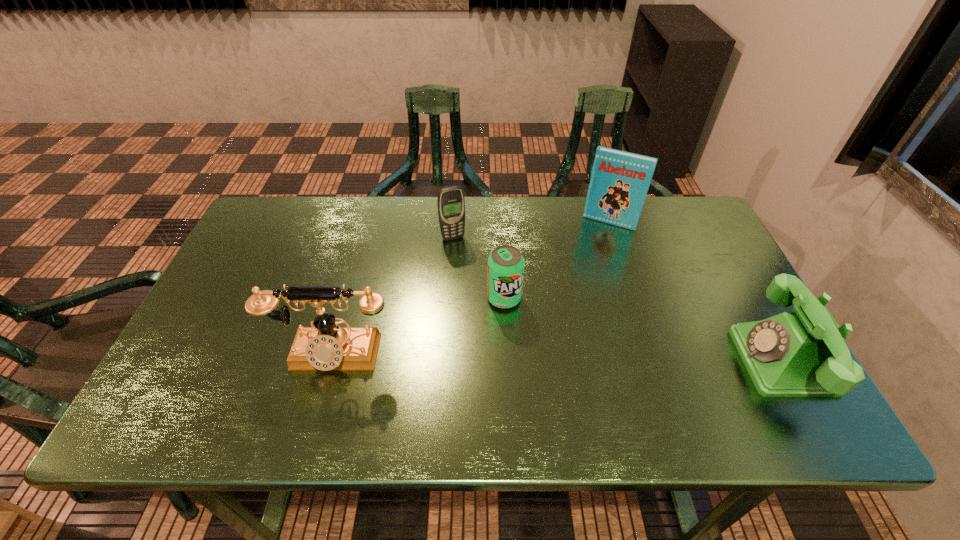
Where is `empty space between the shorter telephone and the cellular telephone`? empty space between the shorter telephone and the cellular telephone is located at coordinates (617, 299).

The height and width of the screenshot is (540, 960). Identify the location of object that is the third closest one to the fourth nearest object. point(620,180).

Locate an element on the screen. object identified as the second closest to the right telephone is located at coordinates (505, 270).

The width and height of the screenshot is (960, 540). I want to click on free location that satisfies the following two spatial constraints: 1. on the front side of the cellular telephone; 2. on the dial of the right telephone, so click(445, 361).

You are a GUI agent. You are given a task and a screenshot of the screen. Output one action in this format:
    pyautogui.click(x=<x>, y=<y>)
    Task: Click on the vacant area that satisfies the following two spatial constraints: 1. on the dial of the shorter telephone; 2. on the dial of the leftmost object
    
    Given the screenshot: What is the action you would take?
    pyautogui.click(x=331, y=361)

Identify the location of vacant position in the image that satisfies the following two spatial constraints: 1. on the dial of the taller telephone; 2. on the dial of the shorter telephone. (331, 361).

This screenshot has width=960, height=540. I want to click on free space that satisfies the following two spatial constraints: 1. on the front side of the third object from left to right; 2. on the dial of the right telephone, so click(x=507, y=361).